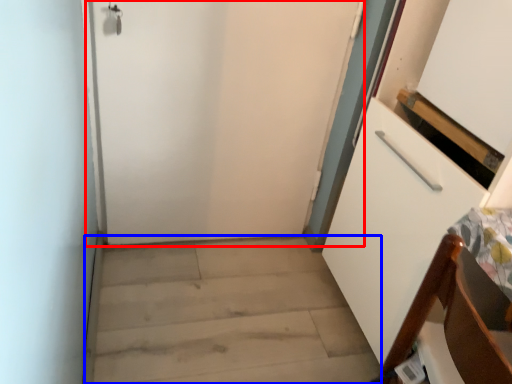
Question: Which object is closer to the camera taking this photo, door (highlighted by a red box) or stairwell (highlighted by a blue box)?

Choices:
 (A) door
 (B) stairwell

Answer: (B)